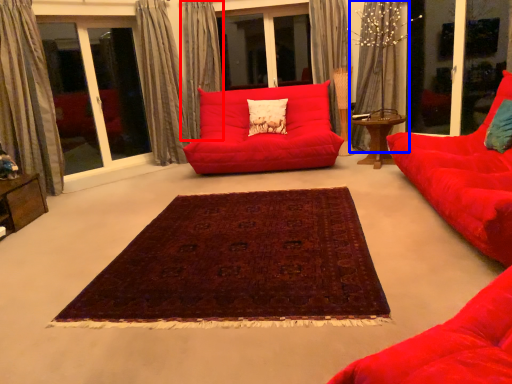
Question: Among these objects, which one is farthest to the camera, curtain (highlighted by a red box) or curtain (highlighted by a blue box)?

Choices:
 (A) curtain
 (B) curtain

Answer: (A)